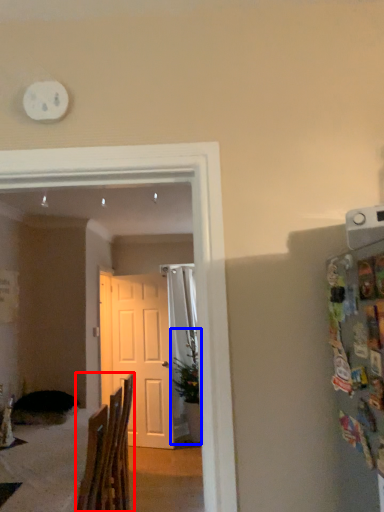
Question: Which of the following is the closest to the observer, chair (highlighted by a red box) or houseplant (highlighted by a blue box)?

Choices:
 (A) chair
 (B) houseplant

Answer: (A)